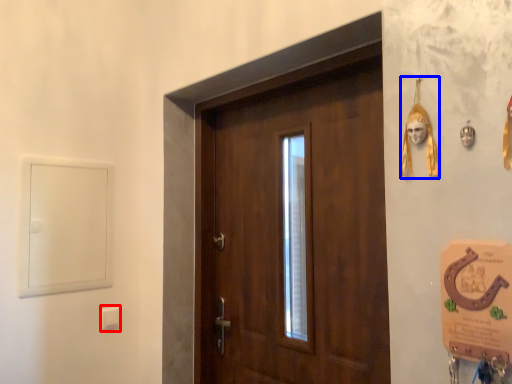
Question: Which of the following is the closest to the observer, light switch (highlighted by a red box) or decor (highlighted by a blue box)?

Choices:
 (A) light switch
 (B) decor

Answer: (B)